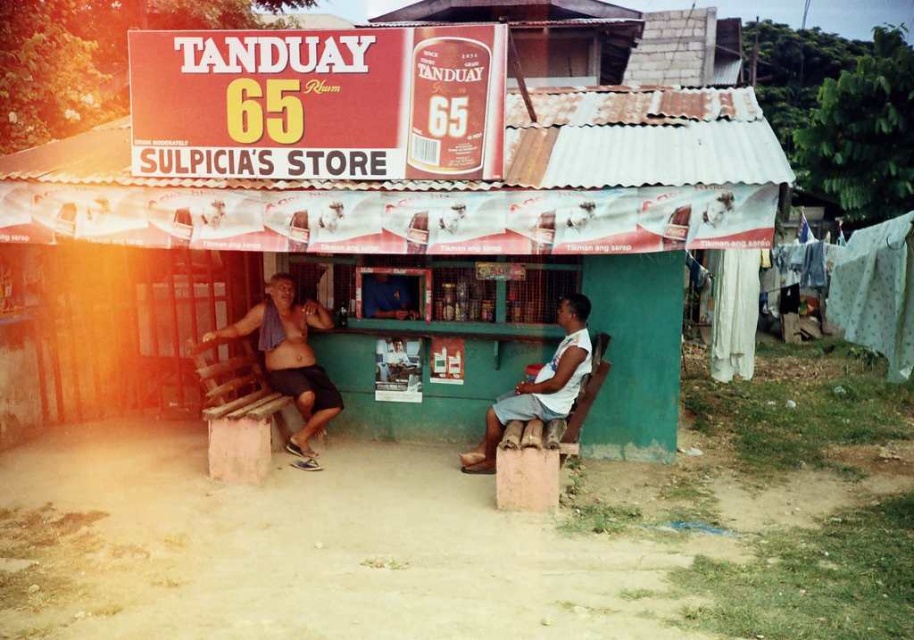
You are a customer entering Sulpicia Store and notice the shiny metallic towel at center and the light brown wooden bench at lower right. Which object is bigger in size?

The shiny metallic towel at center is larger in size compared to the light brown wooden bench at lower right according to the description.

You are a photographer trying to capture the shiny metallic towel at center and the light brown wooden bench at lower right in the same frame. Since you want both objects to be clearly visible, which object should you focus on first to ensure proper depth of field?

The shiny metallic towel at center is taller than the light brown wooden bench at lower right, so focusing on the taller object first will ensure both are in focus.